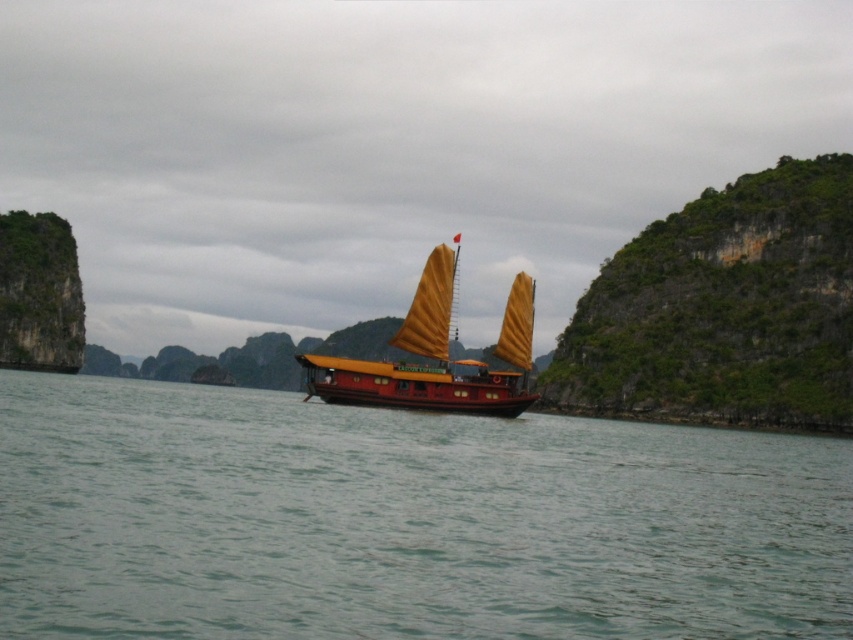
Question: Is clear water at center further to camera compared to shiny red wood boat at center?

Choices:
 (A) no
 (B) yes

Answer: (A)

Question: Does clear water at center appear on the left side of shiny red wood boat at center?

Choices:
 (A) yes
 (B) no

Answer: (B)

Question: Which of the following is the farthest from the observer?

Choices:
 (A) (436, 291)
 (B) (752, 483)

Answer: (A)

Question: Which point is closer to the camera taking this photo?

Choices:
 (A) (192, 609)
 (B) (434, 312)

Answer: (A)

Question: Among these objects, which one is nearest to the camera?

Choices:
 (A) shiny red wood boat at center
 (B) clear water at center

Answer: (B)

Question: From the image, what is the correct spatial relationship of clear water at center in relation to shiny red wood boat at center?

Choices:
 (A) right
 (B) left

Answer: (A)